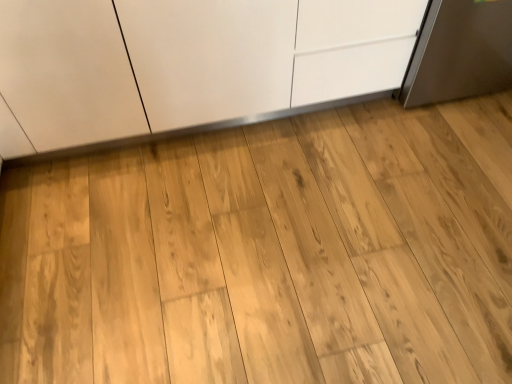
Identify the location of matte white cabinet at center. (187, 63).

The height and width of the screenshot is (384, 512). What do you see at coordinates (187, 63) in the screenshot? I see `matte white cabinet at center` at bounding box center [187, 63].

Measure the distance between point (249, 218) and camera.

They are 1.63 meters apart.

The height and width of the screenshot is (384, 512). What do you see at coordinates (269, 254) in the screenshot? I see `natural wood dresser at center` at bounding box center [269, 254].

Find the location of a particular element. The height and width of the screenshot is (384, 512). natural wood dresser at center is located at coordinates (269, 254).

Identify the location of matte white cabinet at center. This screenshot has height=384, width=512. (187, 63).

Considering the relative positions of natural wood dresser at center and matte white cabinet at center in the image provided, is natural wood dresser at center to the left or to the right of matte white cabinet at center?

Based on their positions, natural wood dresser at center is located to the right of matte white cabinet at center.

Between natural wood dresser at center and matte white cabinet at center, which one is positioned behind?

matte white cabinet at center is further away from the camera.

Is point (282, 283) more distant than point (238, 79)?

No, (282, 283) is in front of (238, 79).

From the image's perspective, is natural wood dresser at center above matte white cabinet at center?

No, from the image's perspective, natural wood dresser at center is not on top of matte white cabinet at center.

From a real-world perspective, does natural wood dresser at center sit lower than matte white cabinet at center?

Yes, from a real-world perspective, natural wood dresser at center is beneath matte white cabinet at center.

Can you confirm if natural wood dresser at center is wider than matte white cabinet at center?

Indeed, natural wood dresser at center has a greater width compared to matte white cabinet at center.

Considering the relative sizes of natural wood dresser at center and matte white cabinet at center in the image provided, is natural wood dresser at center shorter than matte white cabinet at center?

Yes.

Which of these two, natural wood dresser at center or matte white cabinet at center, is bigger?

With larger size is matte white cabinet at center.

Is natural wood dresser at center outside of matte white cabinet at center?

natural wood dresser at center lies outside matte white cabinet at center's area.

Is natural wood dresser at center not near matte white cabinet at center?

No, natural wood dresser at center is in close proximity to matte white cabinet at center.

Could you tell me if natural wood dresser at center is turned towards matte white cabinet at center?

No, natural wood dresser at center is not facing towards matte white cabinet at center.

How many degrees apart are the facing directions of natural wood dresser at center and matte white cabinet at center?

179 degrees.

How distant is natural wood dresser at center from matte white cabinet at center?

natural wood dresser at center is 20.29 inches from matte white cabinet at center.

Image resolution: width=512 pixels, height=384 pixels. Find the location of `dresser that is below the matte white cabinet at center (from the image's perspective)`. dresser that is below the matte white cabinet at center (from the image's perspective) is located at coordinates (269, 254).

Is matte white cabinet at center at the left side of natural wood dresser at center?

Indeed, matte white cabinet at center is positioned on the left side of natural wood dresser at center.

Considering their positions, is matte white cabinet at center located in front of or behind natural wood dresser at center?

matte white cabinet at center is behind natural wood dresser at center.

Is point (189, 66) less distant than point (442, 324)?

No, it is behind (442, 324).

From the image's perspective, is matte white cabinet at center above or below natural wood dresser at center?

From the image's perspective, matte white cabinet at center appears above natural wood dresser at center.

From a real-world perspective, between matte white cabinet at center and natural wood dresser at center, who is vertically higher?

matte white cabinet at center is physically above.

Considering the relative sizes of matte white cabinet at center and natural wood dresser at center in the image provided, is matte white cabinet at center thinner than natural wood dresser at center?

Yes, matte white cabinet at center is thinner than natural wood dresser at center.

Considering the sizes of matte white cabinet at center and natural wood dresser at center in the image, is matte white cabinet at center taller or shorter than natural wood dresser at center?

matte white cabinet at center is taller than natural wood dresser at center.

Can you confirm if matte white cabinet at center is smaller than natural wood dresser at center?

No.

Is natural wood dresser at center located within matte white cabinet at center?

That's incorrect, natural wood dresser at center is not inside matte white cabinet at center.

Is matte white cabinet at center in contact with natural wood dresser at center?

No.

Is natural wood dresser at center at the back of matte white cabinet at center?

matte white cabinet at center does not have its back to natural wood dresser at center.

What's the angular difference between matte white cabinet at center and natural wood dresser at center's facing directions?

179 degrees separate the facing orientations of matte white cabinet at center and natural wood dresser at center.

Find the location of a particular element. dresser on the right of matte white cabinet at center is located at coordinates (269, 254).

Where is `cabinetry above the natural wood dresser at center (from the image's perspective)`? Image resolution: width=512 pixels, height=384 pixels. cabinetry above the natural wood dresser at center (from the image's perspective) is located at coordinates (187, 63).

This screenshot has height=384, width=512. In order to click on dresser on the right of matte white cabinet at center in this screenshot , I will do `click(269, 254)`.